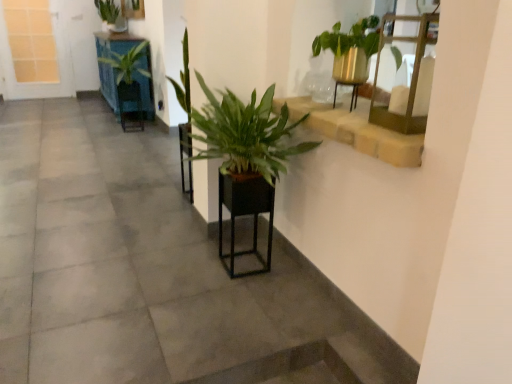
At what (x,y) coordinates should I click in order to perform the action: click on vacant space that is to the left of green matte plant at center, marked as the 2th armchair in a front-to-back arrangement. Please return your answer as a coordinate pair (x, y). Looking at the image, I should click on (163, 197).